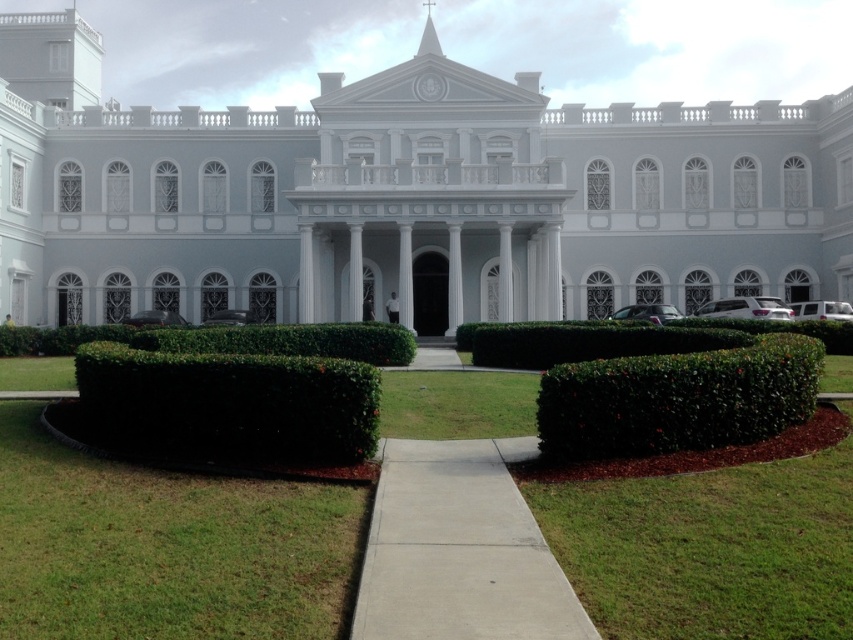
Question: Which point is farther to the camera?

Choices:
 (A) green leafy hedge at center
 (B) dark green hedge at lower left
 (C) green leafy bush at center
 (D) green leafy bush at lower right

Answer: (C)

Question: Based on their relative distances, which object is nearer to the dark green hedge at lower left?

Choices:
 (A) green leafy bush at center
 (B) green grass at center
 (C) green leafy hedge at center

Answer: (B)

Question: Which object appears closest to the camera in this image?

Choices:
 (A) green leafy hedge at center
 (B) green leafy bush at lower right
 (C) white marble palace at center

Answer: (B)

Question: Does white marble palace at center have a larger size compared to green leafy bush at lower right?

Choices:
 (A) no
 (B) yes

Answer: (B)

Question: Can you confirm if dark green hedge at lower left is smaller than green leafy hedge at center?

Choices:
 (A) no
 (B) yes

Answer: (B)

Question: Can you confirm if green leafy bush at lower right is thinner than green leafy hedge at center?

Choices:
 (A) yes
 (B) no

Answer: (A)